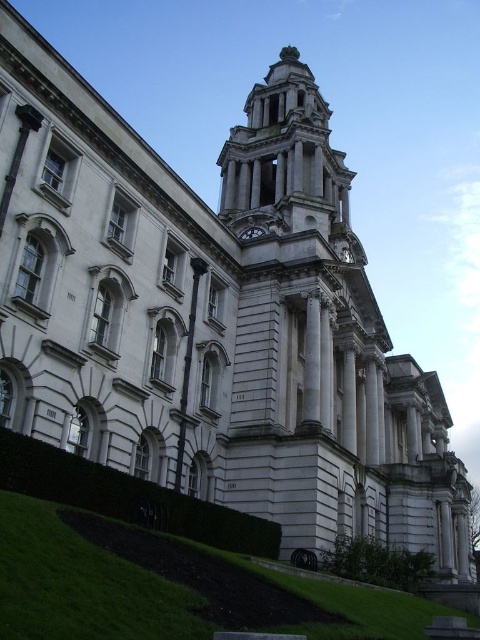
Question: Which point is closer to the camera?

Choices:
 (A) matte silver clock at center
 (B) white stone clock tower at center

Answer: (B)

Question: Is white stone clock tower at center below matte silver clock at center?

Choices:
 (A) yes
 (B) no

Answer: (B)

Question: Which object appears farthest from the camera in this image?

Choices:
 (A) matte silver clock at center
 (B) white stone clock tower at center

Answer: (A)

Question: Is white stone clock tower at center above matte silver clock at center?

Choices:
 (A) yes
 (B) no

Answer: (A)

Question: Can you confirm if white stone clock tower at center is wider than matte silver clock at center?

Choices:
 (A) no
 (B) yes

Answer: (B)